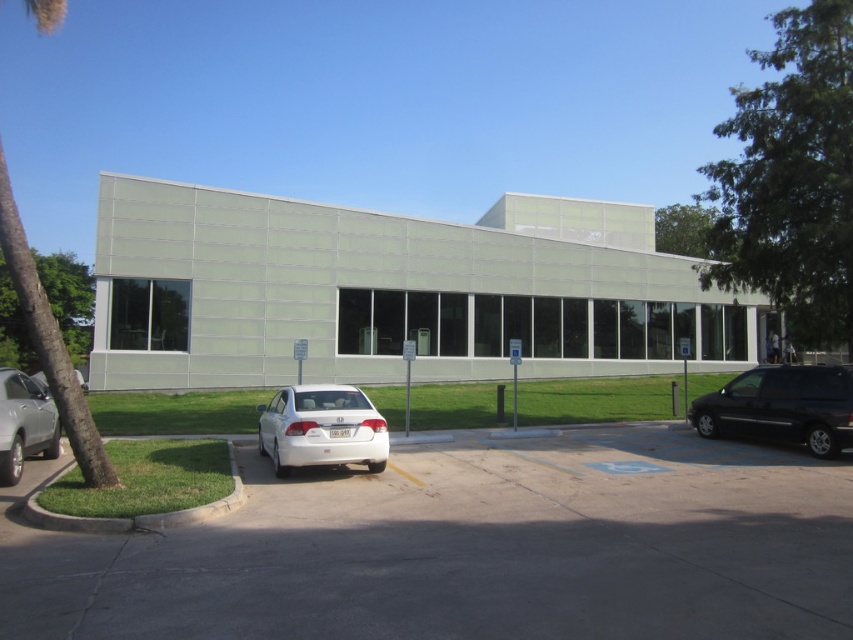
Is green textured palm tree at left smaller than white glossy sedan at center?

No.

Image resolution: width=853 pixels, height=640 pixels. Describe the element at coordinates (50, 340) in the screenshot. I see `green textured palm tree at left` at that location.

At what (x,y) coordinates should I click in order to perform the action: click on green textured palm tree at left. Please return your answer as a coordinate pair (x, y). This screenshot has height=640, width=853. Looking at the image, I should click on (50, 340).

What do you see at coordinates (781, 406) in the screenshot?
I see `black matte van at right` at bounding box center [781, 406].

Between black matte van at right and green textured palm tree at left, which one has more height?

Standing taller between the two is green textured palm tree at left.

Which is behind, point (717, 435) or point (84, 412)?

Positioned behind is point (717, 435).

Where is `black matte van at right`? This screenshot has height=640, width=853. black matte van at right is located at coordinates coord(781,406).

Is green textured palm tree at left bigger than silver metallic sedan at center-left?

Incorrect, green textured palm tree at left is not larger than silver metallic sedan at center-left.

Is green textured palm tree at left to the right of silver metallic sedan at center-left from the viewer's perspective?

Correct, you'll find green textured palm tree at left to the right of silver metallic sedan at center-left.

Is point (3, 212) behind point (85, 388)?

No, it is in front of (85, 388).

Locate an element on the screen. The height and width of the screenshot is (640, 853). green textured palm tree at left is located at coordinates (50, 340).